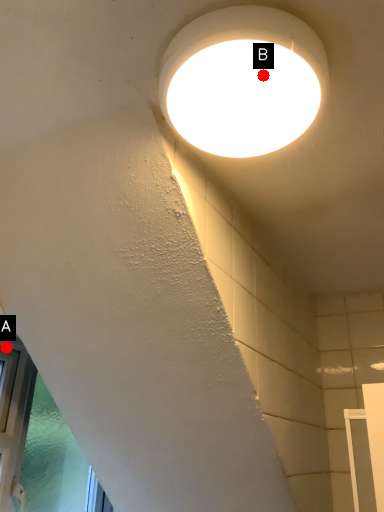
Question: Two points are circled on the image, labeled by A and B beside each circle. Which of the following is the farthest from the observer?

Choices:
 (A) A is further
 (B) B is further

Answer: (A)